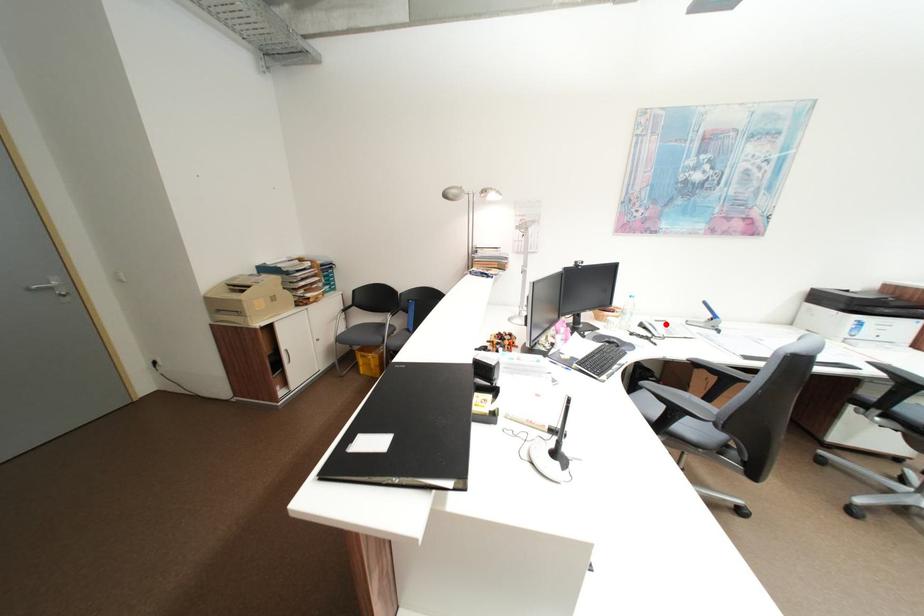
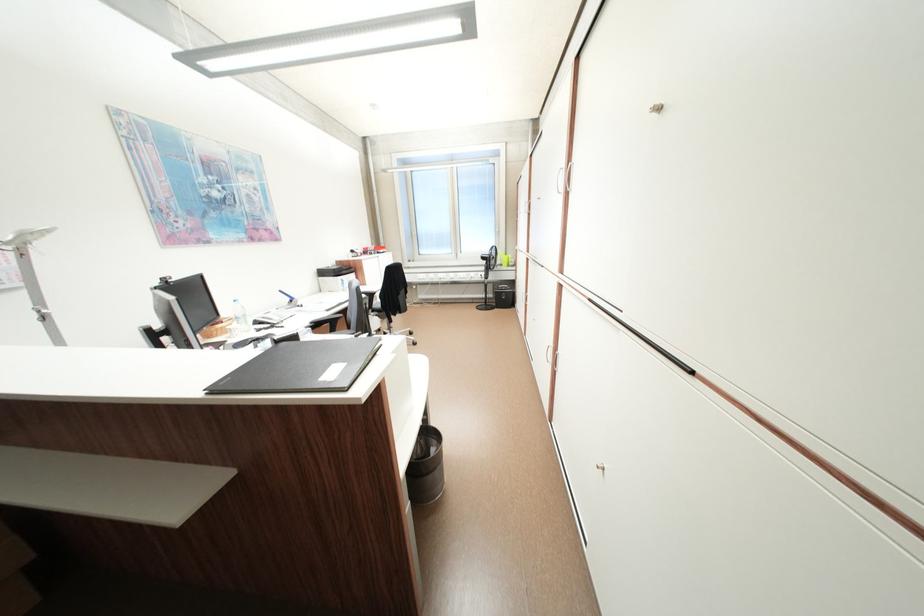
Question: A red point is marked in image1. In image2, is the corresponding 3D point closer to the camera or farther? Reply with the corresponding letter.

Choices:
 (A) The corresponding 3D point is closer.
 (B) The corresponding 3D point is farther.

Answer: (A)